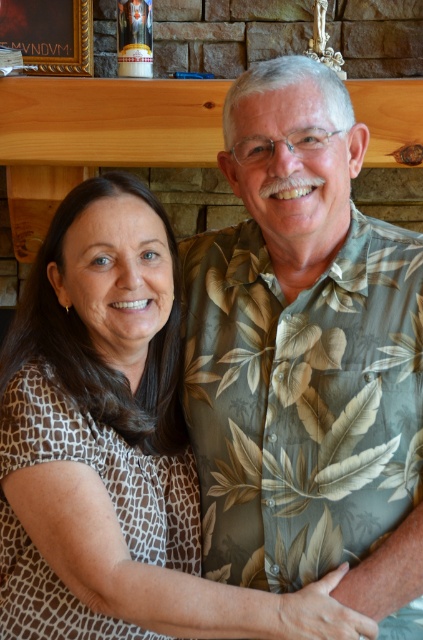
Which of these two, brown textured blouse at center or gold wooden picture frame at upper left, stands taller?

With more height is brown textured blouse at center.

Which is below, brown textured blouse at center or gold wooden picture frame at upper left?

Positioned lower is brown textured blouse at center.

Between point (167, 572) and point (47, 28), which one is positioned in front?

Point (167, 572) is more forward.

Identify the location of brown textured blouse at center. The height and width of the screenshot is (640, 423). (123, 426).

Which is more to the left, green leafy shirt at center or brown textured blouse at center?

Positioned to the left is brown textured blouse at center.

Between point (400, 576) and point (126, 228), which one is positioned behind?

Positioned behind is point (126, 228).

The image size is (423, 640). In order to click on green leafy shirt at center in this screenshot , I will do `click(304, 356)`.

Does green leafy shirt at center appear on the left side of gold wooden picture frame at upper left?

Incorrect, green leafy shirt at center is not on the left side of gold wooden picture frame at upper left.

Is point (334, 509) positioned behind point (54, 10)?

No, it is in front of (54, 10).

Identify the location of green leafy shirt at center. (304, 356).